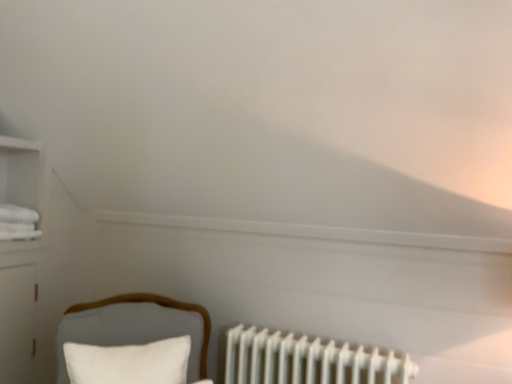
Describe the element at coordinates (129, 362) in the screenshot. The height and width of the screenshot is (384, 512). I see `white soft pillow at lower left` at that location.

Locate an element on the screen. The image size is (512, 384). white soft pillow at lower left is located at coordinates (129, 362).

Where is `white matte radiator at lower right`? white matte radiator at lower right is located at coordinates (308, 360).

Is velvet white chair at lower left facing towards white soft pillow at lower left?

Yes, velvet white chair at lower left is turned towards white soft pillow at lower left.

In terms of height, does velvet white chair at lower left look taller or shorter compared to white soft pillow at lower left?

Clearly, velvet white chair at lower left is taller compared to white soft pillow at lower left.

In order to click on furniture that is under the white soft pillow at lower left (from a real-world perspective) in this screenshot , I will do `click(136, 327)`.

Between point (133, 328) and point (172, 375), which one is positioned in front?

The point (172, 375) is in front.

Is velvet white chair at lower left not inside white matte radiator at lower right?

Yes, velvet white chair at lower left is not within white matte radiator at lower right.

From a real-world perspective, who is located lower, velvet white chair at lower left or white matte radiator at lower right?

white matte radiator at lower right is physically lower.

Is velvet white chair at lower left bigger than white matte radiator at lower right?

Yes.

This screenshot has width=512, height=384. I want to click on furniture in front of the white matte radiator at lower right, so click(x=136, y=327).

How much distance is there between white soft pillow at lower left and velvet white chair at lower left?

4.89 inches.

Would you say white soft pillow at lower left is inside or outside velvet white chair at lower left?

white soft pillow at lower left is inside velvet white chair at lower left.

Considering the relative positions of white soft pillow at lower left and velvet white chair at lower left in the image provided, is white soft pillow at lower left behind velvet white chair at lower left?

Yes, it is behind velvet white chair at lower left.

Identify the location of pillow above the velvet white chair at lower left (from the image's perspective). (129, 362).

Is white matte radiator at lower right not close to white soft pillow at lower left?

No, white matte radiator at lower right is not far away from white soft pillow at lower left.

What's the angular difference between white matte radiator at lower right and white soft pillow at lower left's facing directions?

They differ by 31.1 degrees in their facing directions.

Would you say white matte radiator at lower right is outside white soft pillow at lower left?

Yes, white matte radiator at lower right is located beyond the bounds of white soft pillow at lower left.

Locate an element on the screen. The image size is (512, 384). radiator below the white soft pillow at lower left (from a real-world perspective) is located at coordinates (308, 360).

Does white soft pillow at lower left appear on the right side of white matte radiator at lower right?

Incorrect, white soft pillow at lower left is not on the right side of white matte radiator at lower right.

From the image's perspective, is white soft pillow at lower left on white matte radiator at lower right?

Correct, white soft pillow at lower left appears higher than white matte radiator at lower right in the image.

Measure the distance from white matte radiator at lower right to velvet white chair at lower left.

They are 16.20 inches apart.

Would you say white matte radiator at lower right is to the left or to the right of velvet white chair at lower left in the picture?

In the image, white matte radiator at lower right appears on the right side of velvet white chair at lower left.

Looking at this image, from the image's perspective, which is above, white matte radiator at lower right or velvet white chair at lower left?

From the image's view, velvet white chair at lower left is above.

From a real-world perspective, who is located higher, white matte radiator at lower right or velvet white chair at lower left?

velvet white chair at lower left.

You are a GUI agent. You are given a task and a screenshot of the screen. Output one action in this format:
    pyautogui.click(x=<x>, y=<y>)
    Task: Click on the furniture that is in front of the white soft pillow at lower left
    The height and width of the screenshot is (384, 512).
    Given the screenshot: What is the action you would take?
    pyautogui.click(x=136, y=327)

Locate an element on the screen. radiator beneath the velvet white chair at lower left (from a real-world perspective) is located at coordinates (308, 360).

Which object lies further to the anchor point velvet white chair at lower left, white matte radiator at lower right or white soft pillow at lower left?

white matte radiator at lower right is further to velvet white chair at lower left.

Based on their spatial positions, is velvet white chair at lower left or white matte radiator at lower right further from white soft pillow at lower left?

white matte radiator at lower right is positioned further to the anchor white soft pillow at lower left.

When comparing their distances from white matte radiator at lower right, does white soft pillow at lower left or velvet white chair at lower left seem closer?

velvet white chair at lower left lies closer to white matte radiator at lower right than the other object.

When comparing their distances from white matte radiator at lower right, does velvet white chair at lower left or white soft pillow at lower left seem further?

white soft pillow at lower left.

Based on the photo, which object lies further to the anchor point white soft pillow at lower left, white matte radiator at lower right or velvet white chair at lower left?

Based on the image, white matte radiator at lower right appears to be further to white soft pillow at lower left.

When comparing their distances from velvet white chair at lower left, does white soft pillow at lower left or white matte radiator at lower right seem closer?

white soft pillow at lower left.

Where is `furniture between white soft pillow at lower left and white matte radiator at lower right from left to right`? furniture between white soft pillow at lower left and white matte radiator at lower right from left to right is located at coordinates (136, 327).